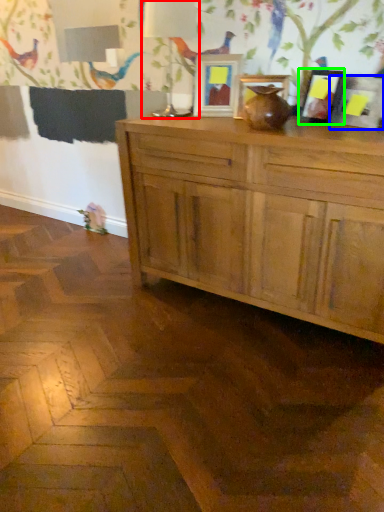
Question: Which object is positioned closest to table lamp (highlighted by a red box)? Select from picture frame (highlighted by a blue box) and picture frame (highlighted by a green box).

Choices:
 (A) picture frame
 (B) picture frame

Answer: (B)